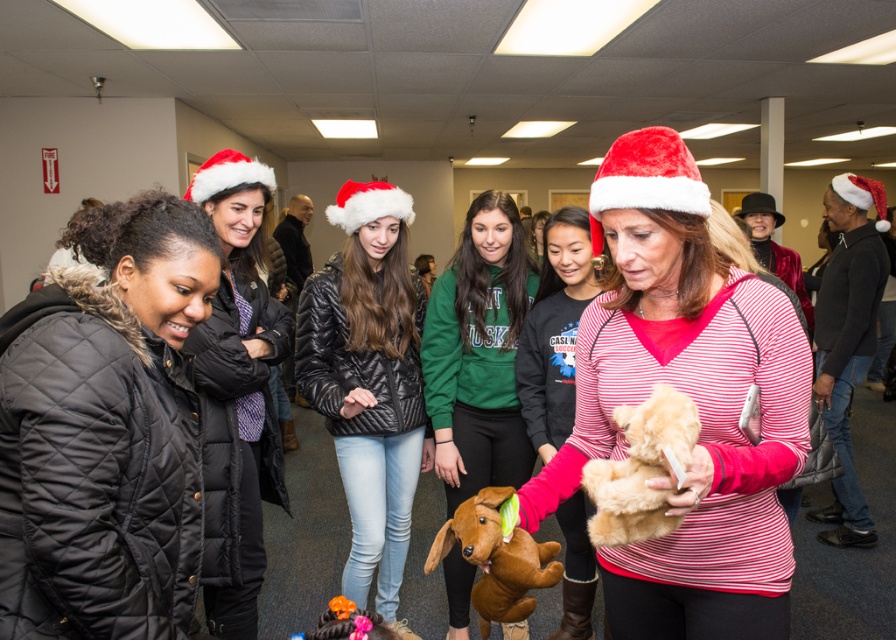
Question: Can you confirm if velvet red santa hat at center is positioned below green fleece sweatshirt at center?

Choices:
 (A) yes
 (B) no

Answer: (B)

Question: Is black quilted jacket at center positioned before matte black jacket at left?

Choices:
 (A) yes
 (B) no

Answer: (B)

Question: Which point is farther to the camera?

Choices:
 (A) (214, 381)
 (B) (633, 458)
 (C) (543, 387)
 (D) (649, 557)

Answer: (C)

Question: Which object is positioned farthest from the black quilted jacket at center?

Choices:
 (A) black quilted jacket at upper left
 (B) black quilted jacket at left
 (C) brown plush dog at center

Answer: (A)

Question: Which of the following is the closest to the observer?

Choices:
 (A) (306, 637)
 (B) (859, 284)
 (C) (98, 259)

Answer: (A)

Question: Does velvet plush dog at center appear on the right side of fuzzy beige teddy bear at center?

Choices:
 (A) yes
 (B) no

Answer: (A)